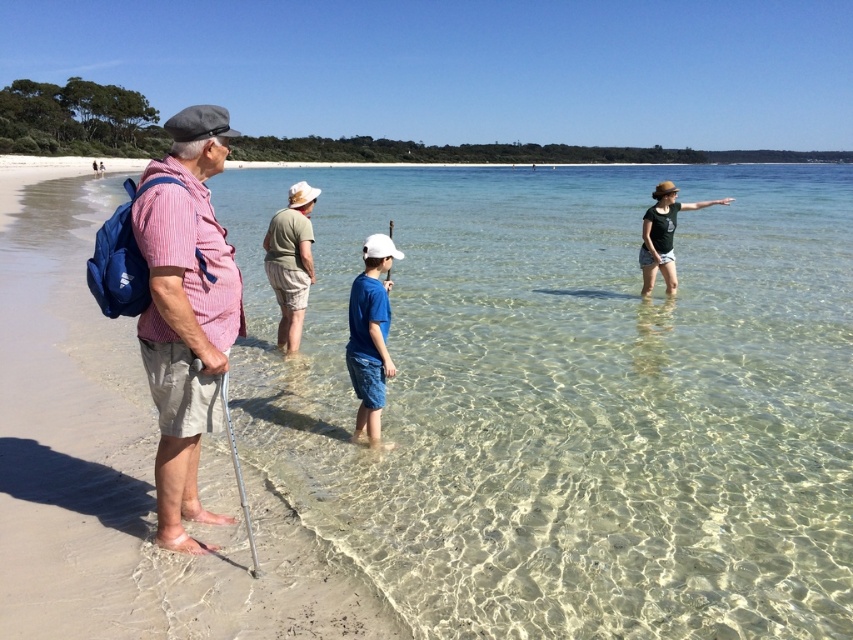
Between clear glassy water at center and smooth sand beach at left, which one is positioned higher?

Positioned higher is clear glassy water at center.

Is clear glassy water at center wider than smooth sand beach at left?

Yes.

Which is in front, point (846, 236) or point (0, 497)?

Point (0, 497) is in front.

At what (x,y) coordinates should I click in order to perform the action: click on clear glassy water at center. Please return your answer as a coordinate pair (x, y). This screenshot has height=640, width=853. Looking at the image, I should click on (572, 397).

This screenshot has height=640, width=853. I want to click on smooth sand beach at left, so click(120, 467).

The image size is (853, 640). I want to click on smooth sand beach at left, so click(x=120, y=467).

I want to click on smooth sand beach at left, so click(x=120, y=467).

Does point (747, 628) come behind point (173, 433)?

No, it is in front of (173, 433).

Does clear glassy water at center have a lesser width compared to striped cotton shirt at left?

No.

What do you see at coordinates (572, 397) in the screenshot? The image size is (853, 640). I see `clear glassy water at center` at bounding box center [572, 397].

This screenshot has height=640, width=853. I want to click on clear glassy water at center, so click(x=572, y=397).